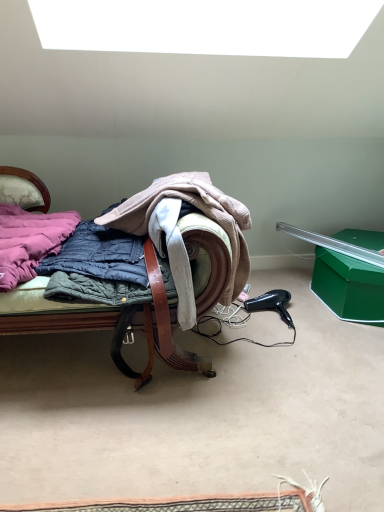
Question: Considering the relative sizes of quilted fabric chair at center and quilted fabric coat at center in the image provided, is quilted fabric chair at center smaller than quilted fabric coat at center?

Choices:
 (A) no
 (B) yes

Answer: (A)

Question: Is quilted fabric coat at center surrounded by quilted fabric chair at center?

Choices:
 (A) yes
 (B) no

Answer: (A)

Question: Considering the relative sizes of quilted fabric chair at center and quilted fabric coat at center in the image provided, is quilted fabric chair at center bigger than quilted fabric coat at center?

Choices:
 (A) yes
 (B) no

Answer: (A)

Question: Is quilted fabric chair at center in front of quilted fabric coat at center?

Choices:
 (A) no
 (B) yes

Answer: (B)

Question: Would you say quilted fabric chair at center is outside quilted fabric coat at center?

Choices:
 (A) yes
 (B) no

Answer: (A)

Question: Considering the positions of point (170, 263) and point (283, 306), is point (170, 263) closer or farther from the camera than point (283, 306)?

Choices:
 (A) closer
 (B) farther

Answer: (A)

Question: In terms of height, does quilted fabric coat at center look taller or shorter compared to black plastic hair dryer at lower right?

Choices:
 (A) short
 (B) tall

Answer: (B)

Question: Looking at the image, does quilted fabric coat at center seem bigger or smaller compared to black plastic hair dryer at lower right?

Choices:
 (A) small
 (B) big

Answer: (B)

Question: Considering the relative positions of quilted fabric coat at center and black plastic hair dryer at lower right in the image provided, is quilted fabric coat at center to the left or to the right of black plastic hair dryer at lower right?

Choices:
 (A) left
 (B) right

Answer: (A)

Question: Considering the positions of point pos(268,304) and point pos(9,272), is point pos(268,304) closer or farther from the camera than point pos(9,272)?

Choices:
 (A) closer
 (B) farther

Answer: (B)

Question: From the image's perspective, relative to pink quilted jacket at left, is black plastic hair dryer at lower right above or below?

Choices:
 (A) below
 (B) above

Answer: (A)

Question: From their relative heights in the image, would you say black plastic hair dryer at lower right is taller or shorter than pink quilted jacket at left?

Choices:
 (A) short
 (B) tall

Answer: (A)

Question: Considering their positions, is black plastic hair dryer at lower right located in front of or behind pink quilted jacket at left?

Choices:
 (A) behind
 (B) front

Answer: (A)

Question: Considering the positions of pink quilted jacket at left and quilted fabric coat at center in the image, is pink quilted jacket at left wider or thinner than quilted fabric coat at center?

Choices:
 (A) thin
 (B) wide

Answer: (B)

Question: In the image, is pink quilted jacket at left on the left side or the right side of quilted fabric coat at center?

Choices:
 (A) right
 (B) left

Answer: (B)